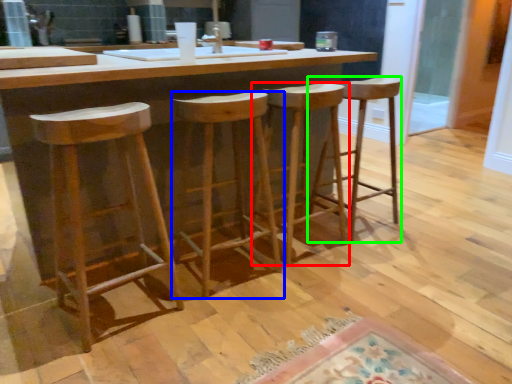
Question: Which object is positioned closest to stool (highlighted by a red box)? Select from stool (highlighted by a blue box) and stool (highlighted by a green box).

Choices:
 (A) stool
 (B) stool

Answer: (B)